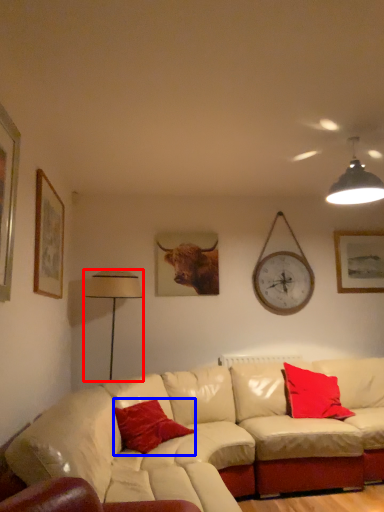
Question: Which object is further to the camera taking this photo, table lamp (highlighted by a red box) or pillow (highlighted by a blue box)?

Choices:
 (A) table lamp
 (B) pillow

Answer: (A)